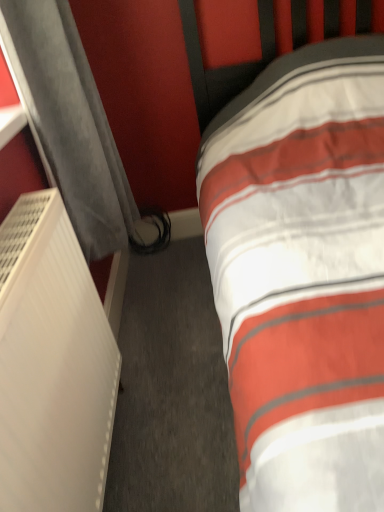
Describe the element at coordinates (71, 123) in the screenshot. Image resolution: width=384 pixels, height=512 pixels. I see `velvet gray curtain at left` at that location.

The height and width of the screenshot is (512, 384). In order to click on velvet gray curtain at left in this screenshot , I will do `click(71, 123)`.

The image size is (384, 512). In order to click on velvet gray curtain at left in this screenshot , I will do `click(71, 123)`.